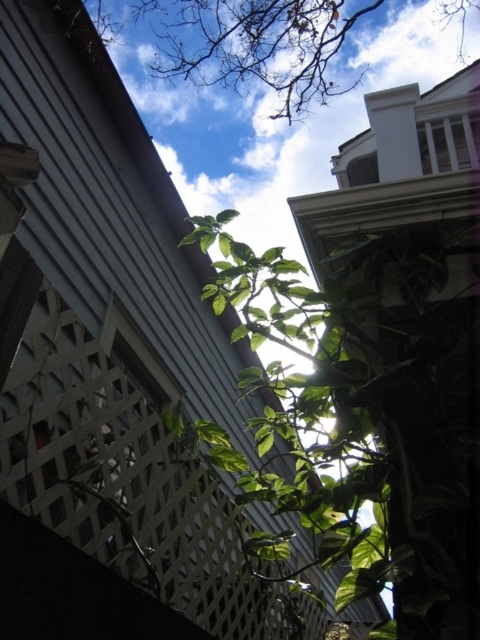
You are standing in the scene and want to reach the point closer to you. Which point should you head towards, point (x=96, y=406) or point (x=288, y=112)?

You should head towards point (x=96, y=406) because it is closer to the viewer than point (x=288, y=112).

You are standing below looking up at the scene. Which object is positioned to the left when you see the white lattice fence at upper center and the green leafy plant at upper center?

The white lattice fence at upper center is to the left of the green leafy plant at upper center.